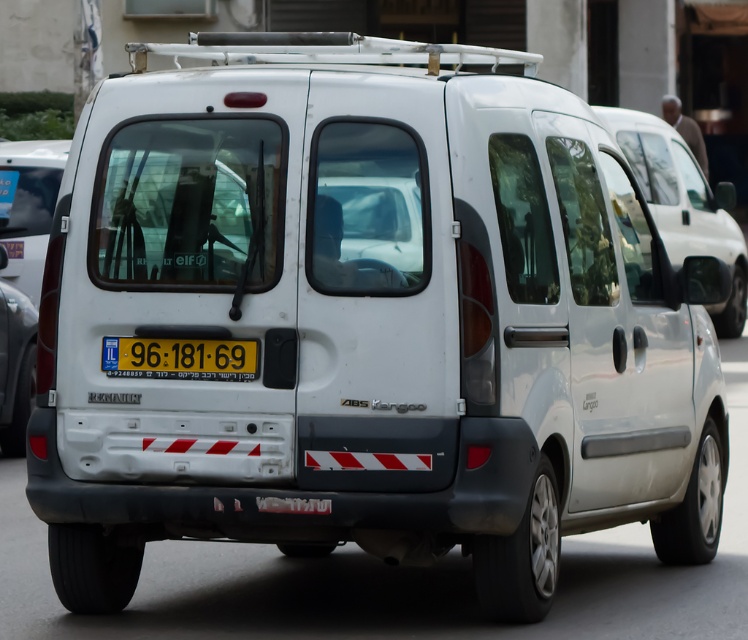
You are a delivery driver who needs to park your white matte van at center in a spot that requires the license plate to be visible. Based on the scene, can you confirm if the yellow plastic license plate at center is positioned in a way that it would be visible when the van is parked?

The white matte van at center is positioned on the right side of the yellow plastic license plate at center, meaning the license plate is centered and visible at the back of the van, so yes, it would be visible when parked.

What are the coordinates of the white matte van at center?

The white matte van at center is located at point (683, 204).

You are standing on the sidewalk and see the white matte van at center parked on the street. If your smartphone has a camera with a 50mm lens, can you take a clear photo of the van from your current position? Explain why or why not.

The white matte van at center is 14.76 meters away from viewer. A 50mm lens on a smartphone typically has a focal length equivalent to a standard lens, which can capture clear images up to several meters away. Since 14.76 meters is within the effective range of a 50mm lens, you can take a clear photo of the van from your current position.